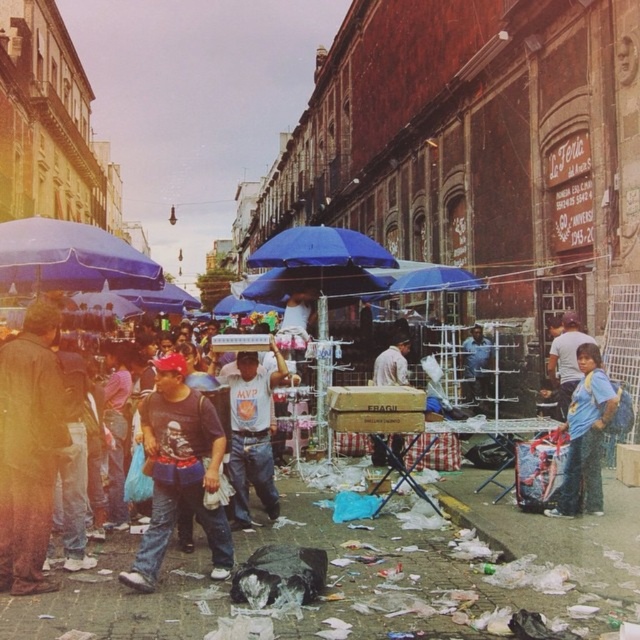
Question: Does dark blue jeans at center appear under blue denim jeans at lower right?

Choices:
 (A) yes
 (B) no

Answer: (B)

Question: Can you confirm if cardboard box at center is bigger than matte black t-shirt at center?

Choices:
 (A) yes
 (B) no

Answer: (A)

Question: Which of the following is the closest to the observer?

Choices:
 (A) blue denim jeans at lower right
 (B) dark blue jeans at center
 (C) white cardboard sign at center
 (D) matte black t-shirt at center

Answer: (B)

Question: Estimate the real-world distances between objects in this image. Which object is farther from the cardboard box at center?

Choices:
 (A) white cardboard sign at center
 (B) matte black t-shirt at center

Answer: (A)

Question: Which object is farther from the camera taking this photo?

Choices:
 (A) blue denim jeans at lower right
 (B) cardboard box at center
 (C) white cardboard sign at center
 (D) blue fabric umbrella at left

Answer: (C)

Question: From the image, what is the correct spatial relationship of matte black t-shirt at center in relation to blue fabric umbrella at left?

Choices:
 (A) right
 (B) left

Answer: (A)